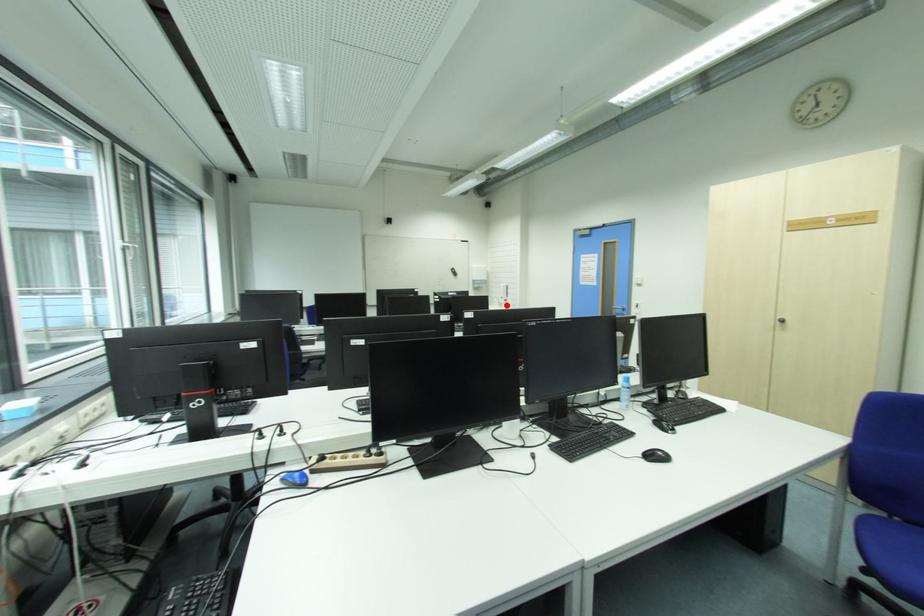
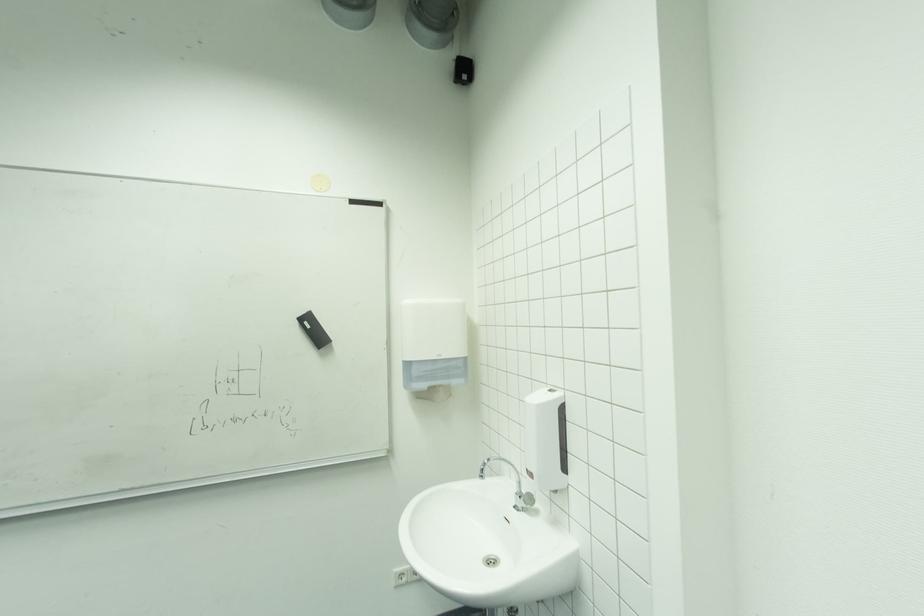
Find the pixel in the second image that matches the highlighted location in the first image.

(536, 501)